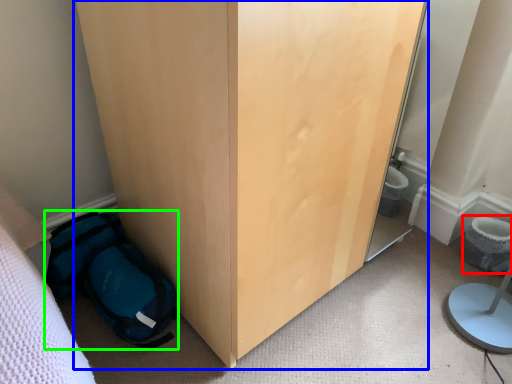
Question: Which object is the farthest from toilet bowl (highlighted by a red box)? Choose among these: furniture (highlighted by a blue box) or backpack (highlighted by a green box).

Choices:
 (A) furniture
 (B) backpack

Answer: (B)